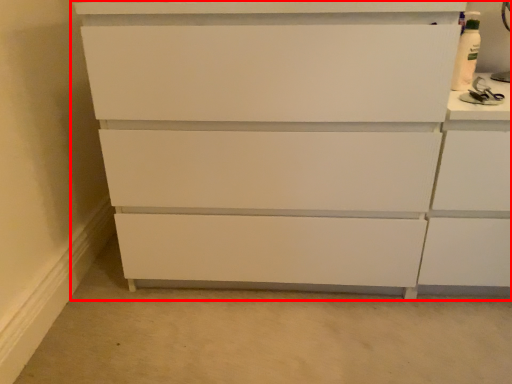
Question: Observing the image, what is the correct spatial positioning of chest of drawers (annotated by the red box) in reference to cabinetry?

Choices:
 (A) left
 (B) right

Answer: (A)